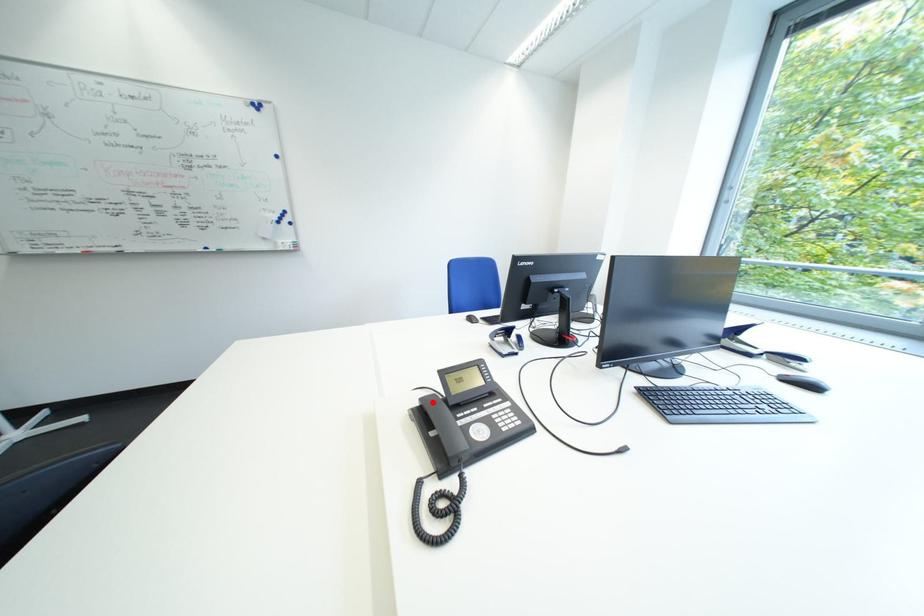
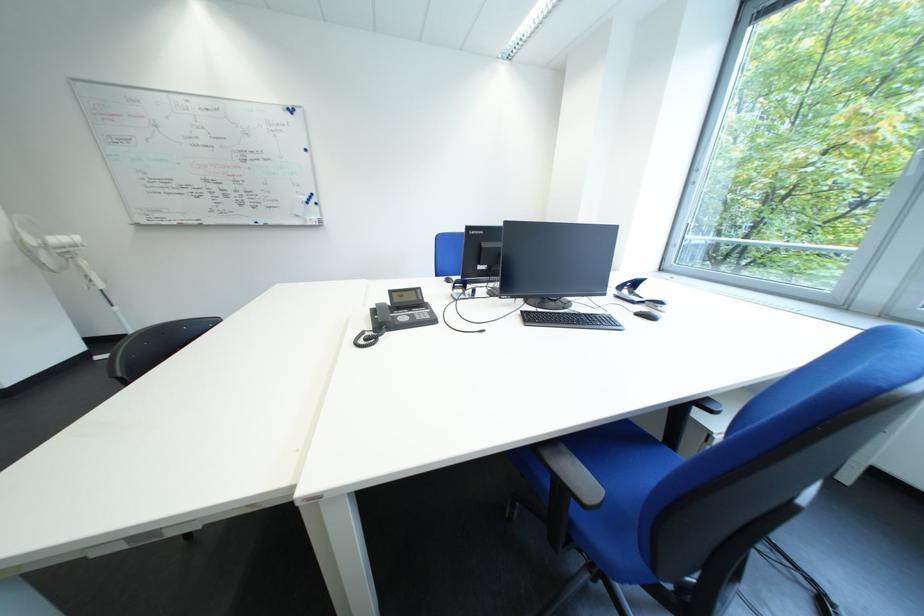
Question: A red point is marked in image1. In image2, is the corresponding 3D point closer to the camera or farther? Reply with the corresponding letter.

Choices:
 (A) The corresponding 3D point is closer.
 (B) The corresponding 3D point is farther.

Answer: (A)